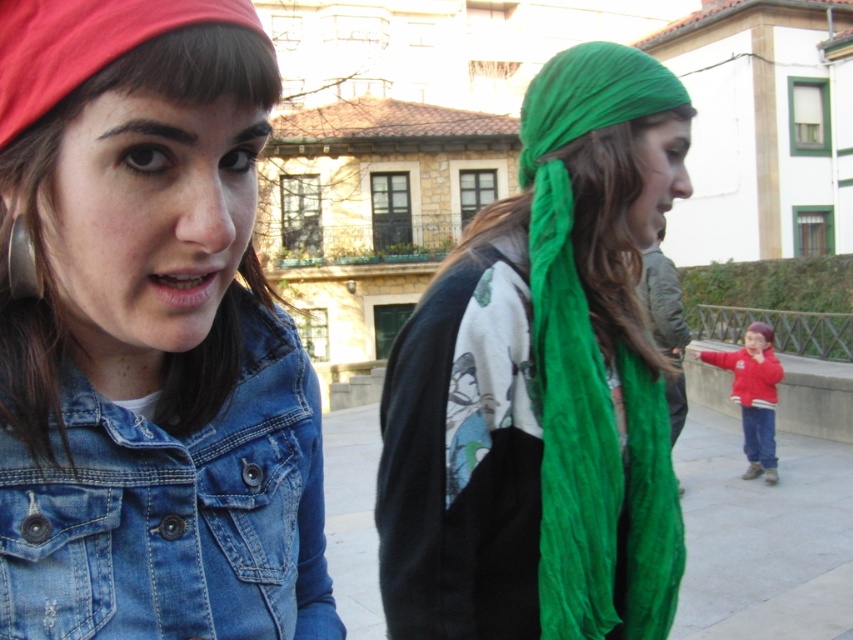
Question: Which object is the closest to the red fleece jacket at right?

Choices:
 (A) denim jacket at lower left
 (B) green crinkled scarf at center
 (C) brownhair at left

Answer: (B)

Question: Can you confirm if denim jacket at lower left is bigger than brownhair at left?

Choices:
 (A) yes
 (B) no

Answer: (B)

Question: Can you confirm if green crinkled scarf at center is bigger than brownhair at left?

Choices:
 (A) yes
 (B) no

Answer: (A)

Question: Which object appears closest to the camera in this image?

Choices:
 (A) green crinkled scarf at center
 (B) brownhair at left

Answer: (B)

Question: Which is farther from the red fleece jacket at right?

Choices:
 (A) denim jacket at lower left
 (B) brownhair at left
 (C) green crinkled scarf at center

Answer: (B)

Question: Can you confirm if green crinkled scarf at center is wider than brownhair at left?

Choices:
 (A) yes
 (B) no

Answer: (A)